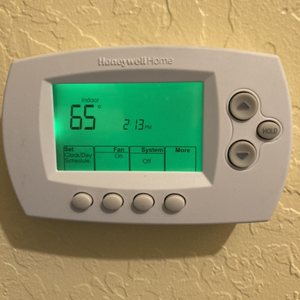
Image resolution: width=300 pixels, height=300 pixels. Identify the location of dented area on the smart thermostat. (49, 123), (134, 181), (211, 126), (138, 75).